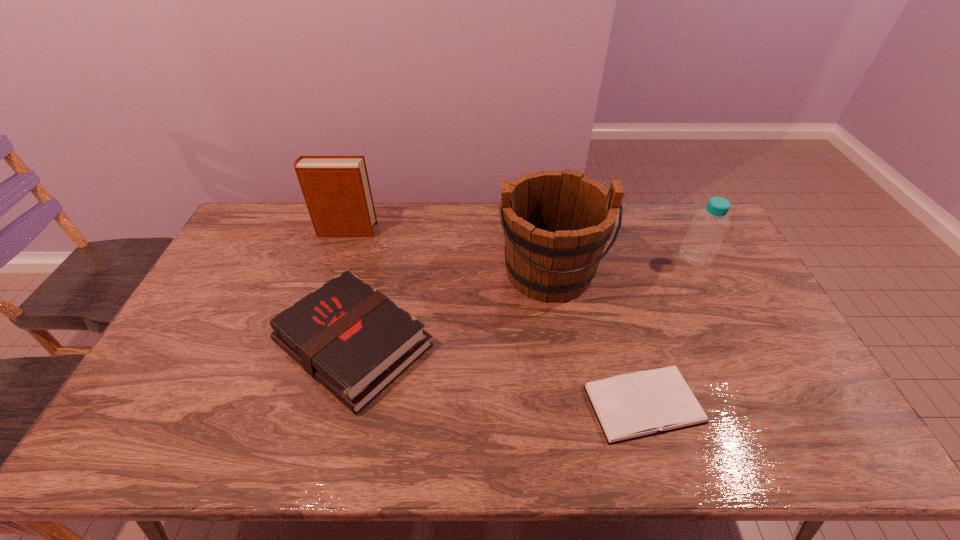
You are a GUI agent. You are given a task and a screenshot of the screen. Output one action in this format:
    pyautogui.click(x=<x>, y=<y>)
    Task: Click on the vacant space situated on the back of the bottle
    
    Given the screenshot: What is the action you would take?
    pyautogui.click(x=674, y=217)

This screenshot has width=960, height=540. I want to click on vacant point located on the right of the second shortest hardback book, so (520, 345).

Find the location of a particular element. The width and height of the screenshot is (960, 540). vacant position located 0.270m on the back of the shortest hardback book is located at coordinates (612, 296).

Where is `wine bucket present at the far edge`? wine bucket present at the far edge is located at coordinates [x=556, y=224].

Where is `hardback book that is positioned at the far edge`? This screenshot has height=540, width=960. hardback book that is positioned at the far edge is located at coordinates (336, 188).

Image resolution: width=960 pixels, height=540 pixels. Find the location of `object positioned at the near edge`. object positioned at the near edge is located at coordinates (630, 406).

Locate an element on the screen. This screenshot has width=960, height=540. object positioned at the right edge is located at coordinates (701, 244).

In the image, there is a desktop. Find the location of `free space at the far edge`. free space at the far edge is located at coordinates (448, 206).

In the image, there is a desktop. Identify the location of free region at the near edge. The width and height of the screenshot is (960, 540). (199, 437).

In the image, there is a desktop. Where is `vacant space at the left edge`? The image size is (960, 540). vacant space at the left edge is located at coordinates (250, 277).